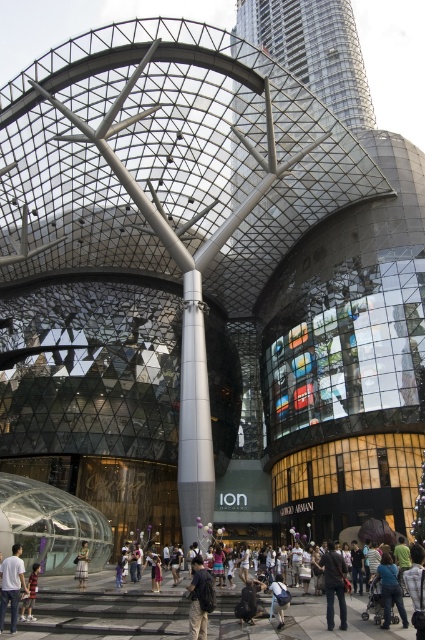
Does white glossy pillar at center have a lesser height compared to dark brown leather jacket at center?

No, white glossy pillar at center is not shorter than dark brown leather jacket at center.

Can you confirm if white glossy pillar at center is taller than dark brown leather jacket at center?

Indeed, white glossy pillar at center has a greater height compared to dark brown leather jacket at center.

Image resolution: width=425 pixels, height=640 pixels. Describe the element at coordinates (193, 417) in the screenshot. I see `white glossy pillar at center` at that location.

Identify the location of white glossy pillar at center. (193, 417).

Who is more distant from viewer, (329,550) or (34,570)?

The point (34,570) is more distant.

This screenshot has height=640, width=425. What do you see at coordinates (334, 584) in the screenshot?
I see `dark brown leather jacket at center` at bounding box center [334, 584].

What are the coordinates of `dark brown leather jacket at center` in the screenshot? It's located at (334, 584).

Where is `dark brown leather jacket at center`? The image size is (425, 640). dark brown leather jacket at center is located at coordinates (334, 584).

Consider the image. Does glassy steel tower at upper center have a greater width compared to dark brown leather jacket at center?

Correct, the width of glassy steel tower at upper center exceeds that of dark brown leather jacket at center.

Is glassy steel tower at upper center further to the viewer compared to dark brown leather jacket at center?

Yes, it is behind dark brown leather jacket at center.

Is point (328, 1) positioned behind point (342, 592)?

That is True.

Where is `glassy steel tower at upper center`? The image size is (425, 640). glassy steel tower at upper center is located at coordinates (314, 51).